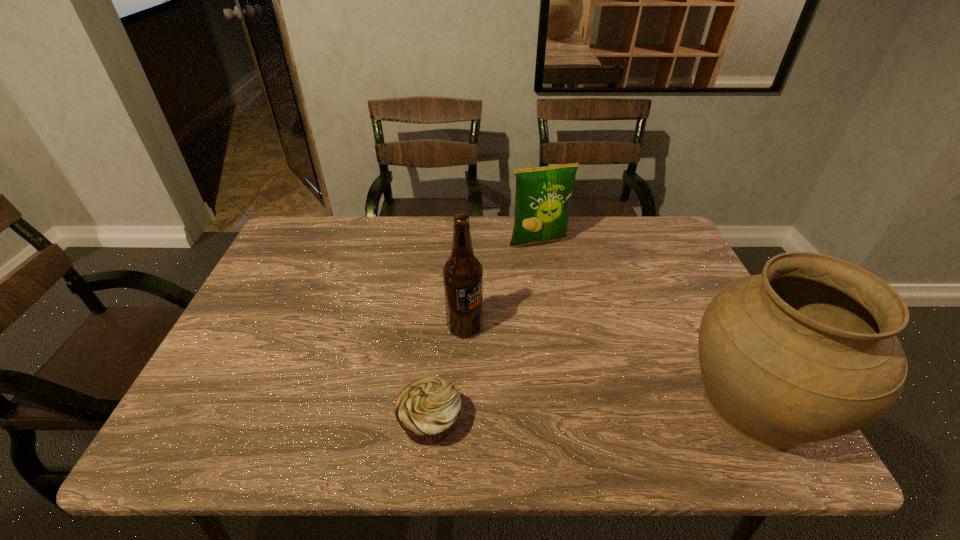
Locate an element on the screen. The width and height of the screenshot is (960, 540). vacant space at the right edge is located at coordinates (675, 333).

What are the coordinates of `vacant space at the far right corner of the desktop` in the screenshot? It's located at (656, 243).

You are a GUI agent. You are given a task and a screenshot of the screen. Output one action in this format:
    pyautogui.click(x=<x>, y=<y>)
    Task: Click on the free spot between the rightmost object and the muffin
    The image size is (960, 540).
    Given the screenshot: What is the action you would take?
    click(592, 413)

You are a GUI agent. You are given a task and a screenshot of the screen. Output one action in this format:
    pyautogui.click(x=<x>, y=<y>)
    Task: Click on the empty space between the rightmost object and the third tallest object
    
    Given the screenshot: What is the action you would take?
    pyautogui.click(x=647, y=323)

Identify the location of free point between the urn and the crisp (potato chip). The height and width of the screenshot is (540, 960). (647, 323).

You are a GUI agent. You are given a task and a screenshot of the screen. Output one action in this format:
    pyautogui.click(x=<x>, y=<y>)
    Task: Click on the vacant area that lies between the shortest object and the farthest object
    The height and width of the screenshot is (540, 960).
    Given the screenshot: What is the action you would take?
    pyautogui.click(x=485, y=332)

Image resolution: width=960 pixels, height=540 pixels. What are the coordinates of `free space between the third object from left to right and the third nearest object` in the screenshot? It's located at (502, 285).

Where is `free space between the farthest object and the muffin`? The image size is (960, 540). free space between the farthest object and the muffin is located at coordinates (485, 332).

Where is `free space between the farthest object and the shortest object`? The width and height of the screenshot is (960, 540). free space between the farthest object and the shortest object is located at coordinates (485, 332).

The width and height of the screenshot is (960, 540). Identify the location of vacant region between the muffin and the urn. (592, 413).